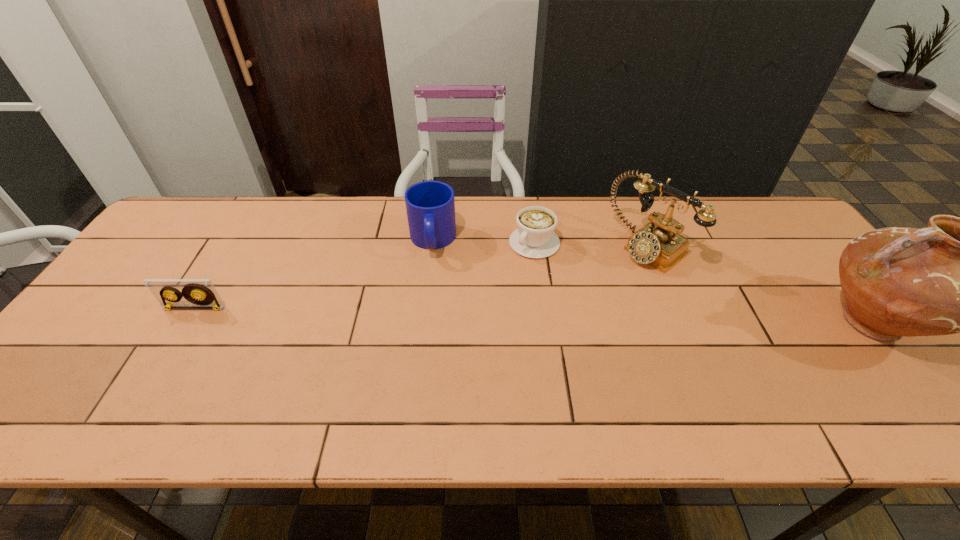
The image size is (960, 540). In order to click on object identified as the second closest to the tallest object in this screenshot , I will do `click(535, 238)`.